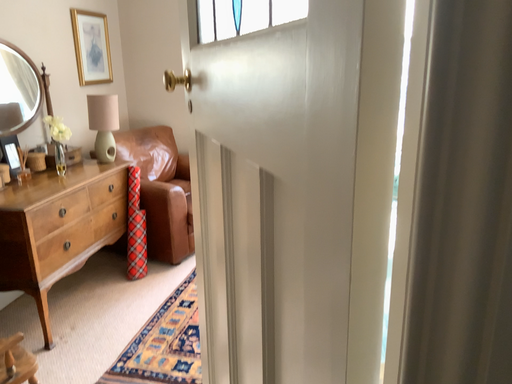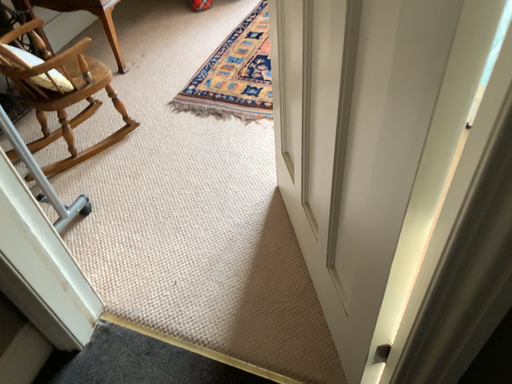
Question: Which way did the camera rotate in the video?

Choices:
 (A) rotated downward
 (B) rotated upward

Answer: (A)